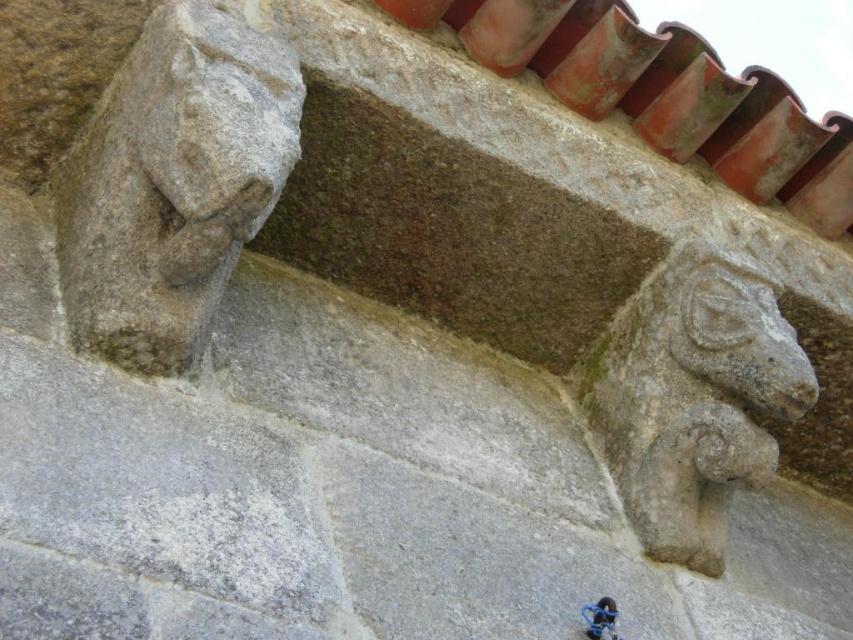
Question: Among these objects, which one is nearest to the camera?

Choices:
 (A) gray stone ram at upper right
 (B) blue metallic bicycle at lower right
 (C) gray stone carving at upper left

Answer: (C)

Question: Does gray stone carving at upper left have a lesser width compared to blue metallic bicycle at lower right?

Choices:
 (A) yes
 (B) no

Answer: (B)

Question: Which is farther from the gray stone ram at upper right?

Choices:
 (A) blue metallic bicycle at lower right
 (B) gray stone carving at upper left

Answer: (B)

Question: Does gray stone carving at upper left appear over blue metallic bicycle at lower right?

Choices:
 (A) no
 (B) yes

Answer: (B)

Question: Among these objects, which one is farthest from the camera?

Choices:
 (A) gray stone ram at upper right
 (B) blue metallic bicycle at lower right
 (C) gray stone carving at upper left

Answer: (A)

Question: Is the position of gray stone carving at upper left less distant than that of gray stone ram at upper right?

Choices:
 (A) yes
 (B) no

Answer: (A)